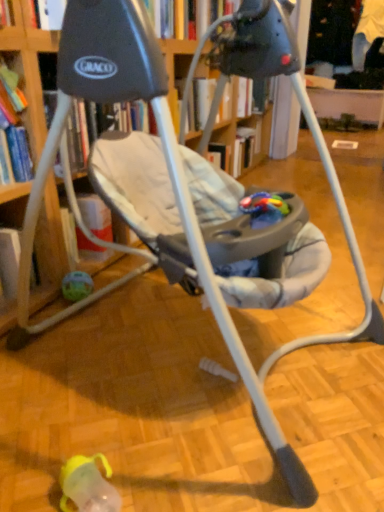
The height and width of the screenshot is (512, 384). What are the coordinates of `vacant location behind translucent plastic ball at lower left, the first toy in the bottom-to-top sequence` in the screenshot? It's located at tap(109, 275).